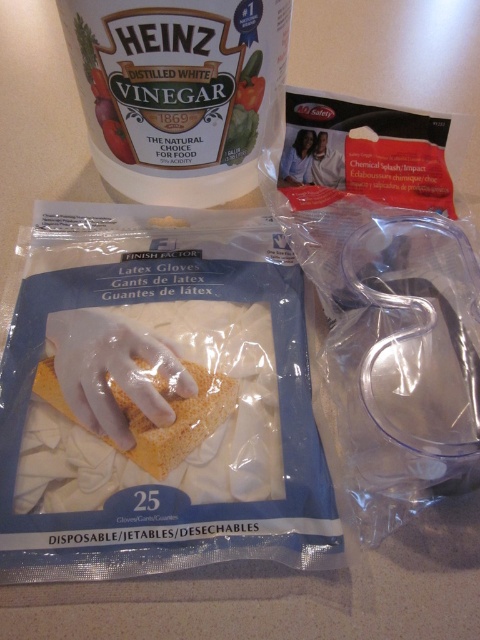
You are organizing cleaning supplies on a countertop and need to place a new item between the white plastic container at upper left and the yellow sponge at center. Based on their positions, which object is closer to you, and where should you position the new item?

The white plastic container at upper left is closer to you than the yellow sponge at center. To place the new item between them, position it behind the white plastic container at upper left but in front of the yellow sponge at center.

You are organizing cleaning supplies on the countertop. The Heinz Distilled White Vinegar jug is at the center. Where is the white plastic container at upper left in relation to the jug?

The white plastic container at upper left is located at point (177, 92) relative to the Heinz Distilled White Vinegar jug at the center.

You have a small container that can only hold items narrower than the yellow sponge at center. Can you place the white plastic container at upper left into it?

The white plastic container at upper left is wider than the yellow sponge at center, so it cannot fit into the small container designed for items narrower than the sponge.